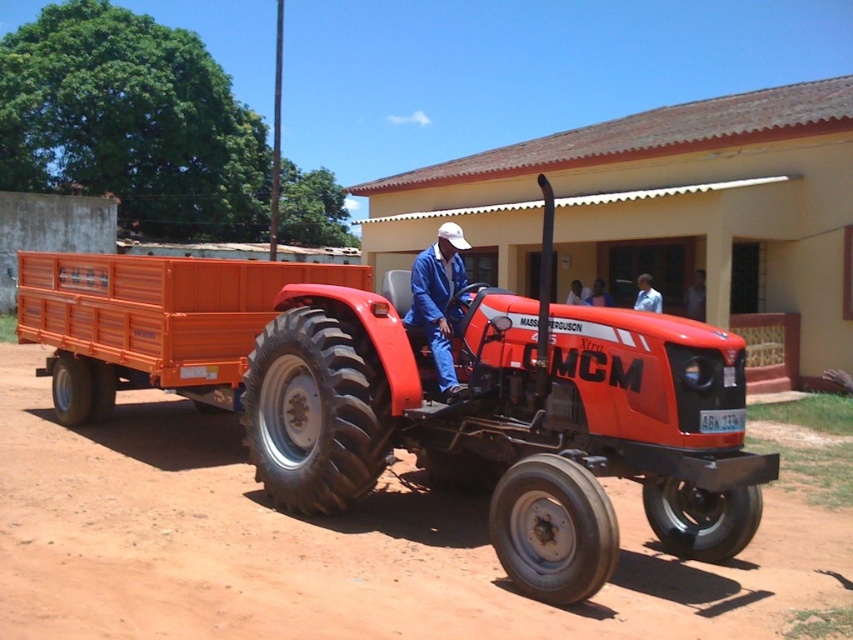
Consider the image. You are a farmer who needs to attach the orange plastic wagon at center to the back of your tractor. The tractor already has a matte orange trailer at center attached. Can you attach the wagon behind the trailer without exceeding the maximum allowed length of 10 feet for the tractor and its attachments combined?

The matte orange trailer at center is 5.40 feet away from orange plastic wagon at center. Since the total length would be the sum of the tractor, trailer, and wagon, but the question only provides the distance between the trailer and wagon. Without knowing the tractor length or the trailer and wagon lengths individually, it is impossible to determine if the total length exceeds 10 feet. However, the distance between the trailer and wagon is 5.40 feet, which might indicate spacing rather than attachment. The

You are standing next to the tractor and need to reach both the blue denim jacket at center and the blue fabric shirt at center. Which item is farther from you?

The blue denim jacket at center is 25.37 feet away from the blue fabric shirt at center, so the blue denim jacket at center is farther away from you.